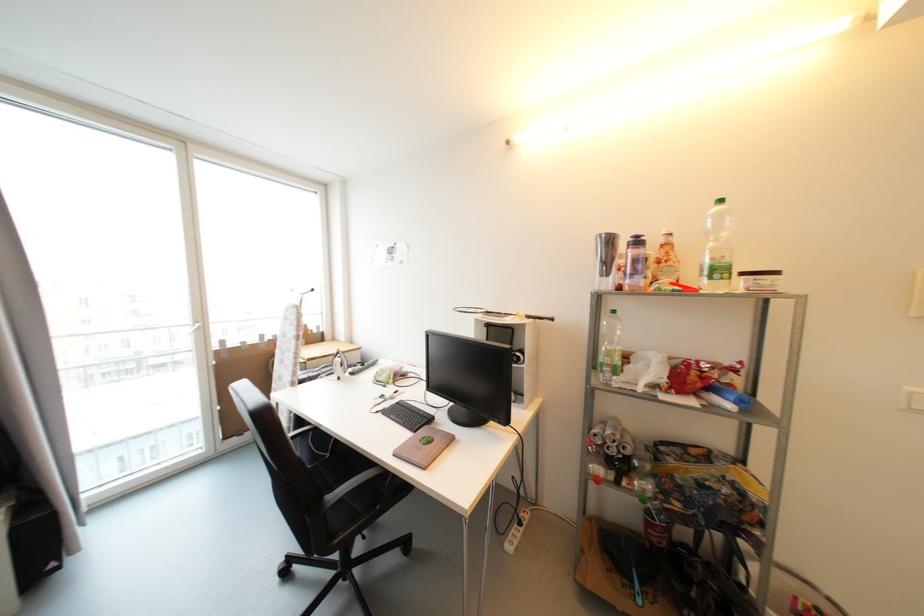
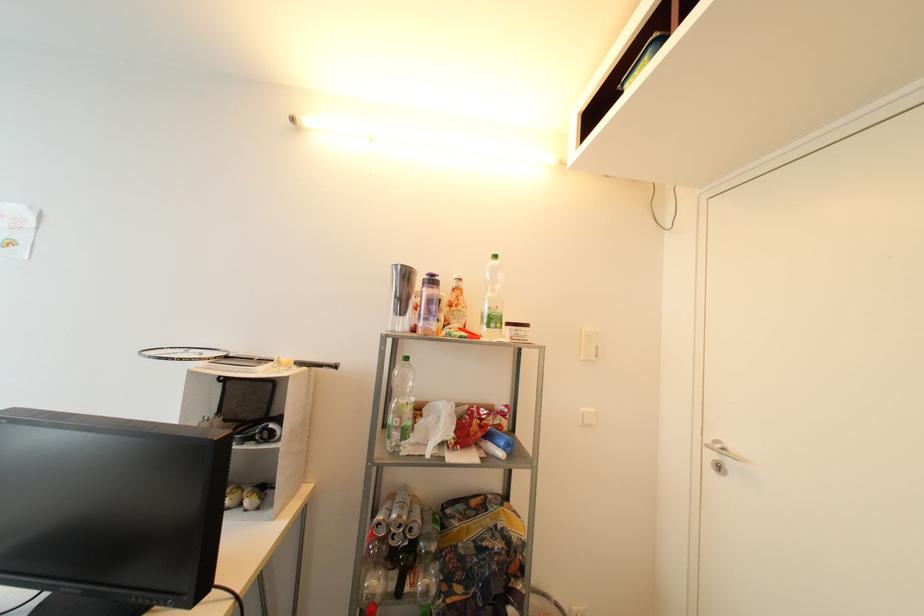
Locate, in the second image, the point that corresponds to point (493, 314) in the first image.

(232, 359)